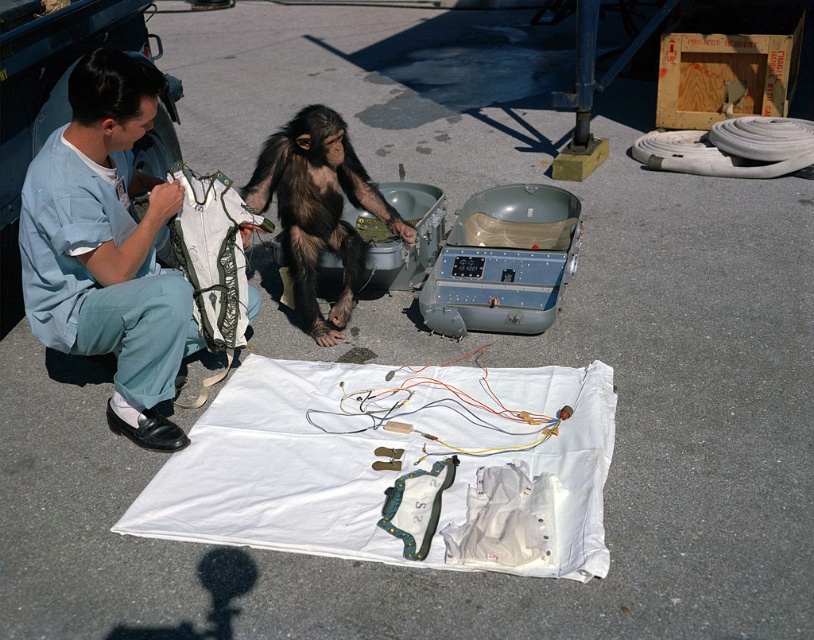
Question: Among these objects, which one is farthest from the camera?

Choices:
 (A) brown furry monkey at center
 (B) light blue fabric at left

Answer: (A)

Question: Does light blue fabric at left have a larger size compared to brown furry monkey at center?

Choices:
 (A) no
 (B) yes

Answer: (B)

Question: Among these points, which one is farthest from the camera?

Choices:
 (A) (46, 228)
 (B) (326, 342)

Answer: (B)

Question: Can you confirm if light blue fabric at left is positioned below brown furry monkey at center?

Choices:
 (A) yes
 (B) no

Answer: (A)

Question: Does light blue fabric at left appear over brown furry monkey at center?

Choices:
 (A) yes
 (B) no

Answer: (B)